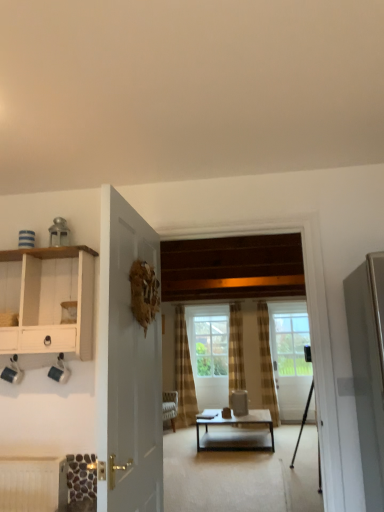
Question: Considering the relative sizes of metallic tripod at center and white glossy door at center, which is the first door from left to right, in the image provided, is metallic tripod at center wider than white glossy door at center, which is the first door from left to right,?

Choices:
 (A) no
 (B) yes

Answer: (B)

Question: Is metallic tripod at center shorter than white glossy door at center, which appears as the 2th door when viewed from the back?

Choices:
 (A) yes
 (B) no

Answer: (A)

Question: Is the position of metallic tripod at center more distant than that of white glossy door at center, the second door viewed from the right?

Choices:
 (A) no
 (B) yes

Answer: (B)

Question: Is the surface of metallic tripod at center in direct contact with white glossy door at center, the second door viewed from the right?

Choices:
 (A) no
 (B) yes

Answer: (A)

Question: Does metallic tripod at center have a greater height compared to white glossy door at center, which is the first door from left to right?

Choices:
 (A) yes
 (B) no

Answer: (B)

Question: From the image's perspective, does metallic tripod at center appear higher than white glossy door at center, which appears as the 2th door when viewed from the back?

Choices:
 (A) yes
 (B) no

Answer: (B)

Question: Is white glossy door at center, placed as the 1th door when sorted from top to bottom, far from matte black coffee table at center?

Choices:
 (A) yes
 (B) no

Answer: (A)

Question: From a real-world perspective, is white glossy door at center, which is the first door from left to right, over matte black coffee table at center?

Choices:
 (A) yes
 (B) no

Answer: (A)

Question: Can you confirm if white glossy door at center, which is the first door from left to right, is taller than matte black coffee table at center?

Choices:
 (A) no
 (B) yes

Answer: (B)

Question: Considering the relative sizes of white glossy door at center, placed as the 1th door when sorted from top to bottom, and matte black coffee table at center in the image provided, is white glossy door at center, placed as the 1th door when sorted from top to bottom, wider than matte black coffee table at center?

Choices:
 (A) no
 (B) yes

Answer: (A)

Question: From the image's perspective, does white glossy door at center, the 2th door from the bottom, appear higher than matte black coffee table at center?

Choices:
 (A) no
 (B) yes

Answer: (B)

Question: Can you confirm if white glossy door at center, placed as the 1th door when sorted from top to bottom, is bigger than matte black coffee table at center?

Choices:
 (A) no
 (B) yes

Answer: (A)

Question: Is clear glass door at center, positioned as the first door in back-to-front order, taller than matte black coffee table at center?

Choices:
 (A) yes
 (B) no

Answer: (A)